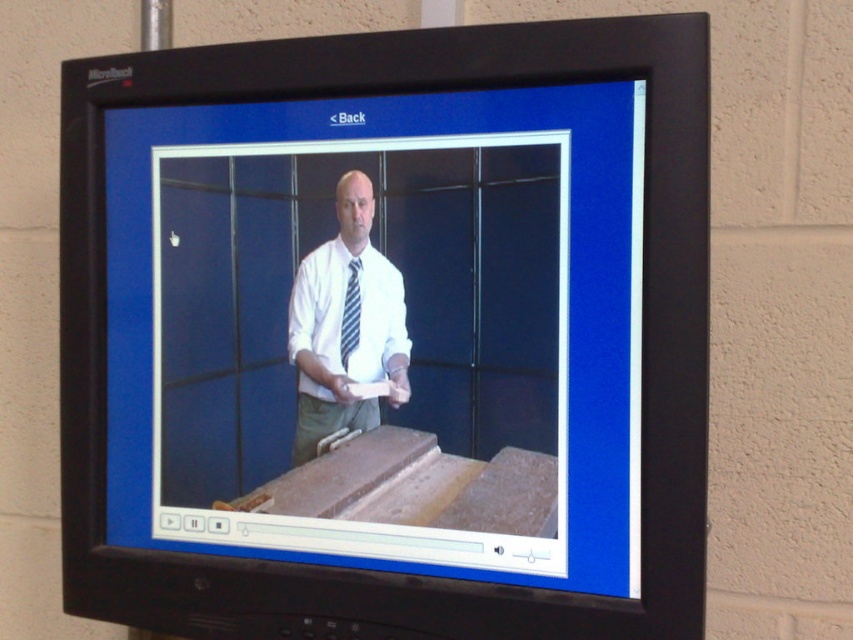
Is point (375, 296) closer to camera compared to point (346, 308)?

That is True.

Who is higher up, white glossy shirt at center or striped fabric tie at center?

striped fabric tie at center

Who is more distant from viewer, (x=299, y=316) or (x=351, y=260)?

Point (x=299, y=316)

Where is `white glossy shirt at center`? white glossy shirt at center is located at coordinates [x=345, y=324].